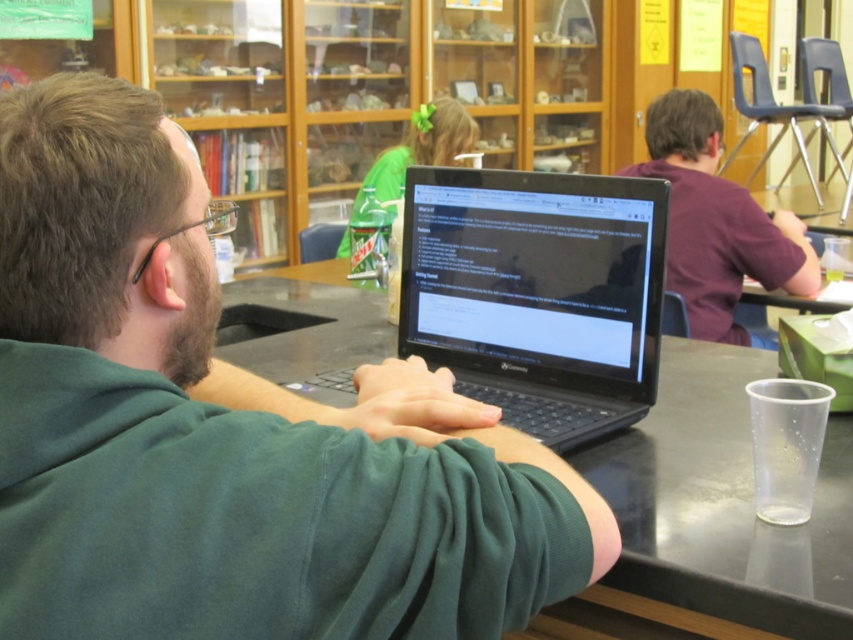
You are a student in the classroom and you need to place a notebook between the green matte laptop at center and the green fabric hairband at upper center. Which side of the laptop should you place it on?

The green matte laptop at center is positioned on the left side of the green fabric hairband at upper center, so you should place the notebook to the right of the laptop to position it between them.

You are a delivery robot that needs to deliver a package to the person at point (767, 600). Your current position is at point 0.000, 0.000. The maximum distance you can travel is 80 centimeters. Can you reach them?

The distance between your current position and the person at point (767, 600) is 83.59 centimeters, which exceeds your maximum travel distance of 80 centimeters. Therefore, you cannot reach them.

In the classroom scene, you see a purple matte shirt at upper right and a green fabric hairband at upper center. Which object is wider?

The purple matte shirt at upper right is wider than the green fabric hairband at upper center.